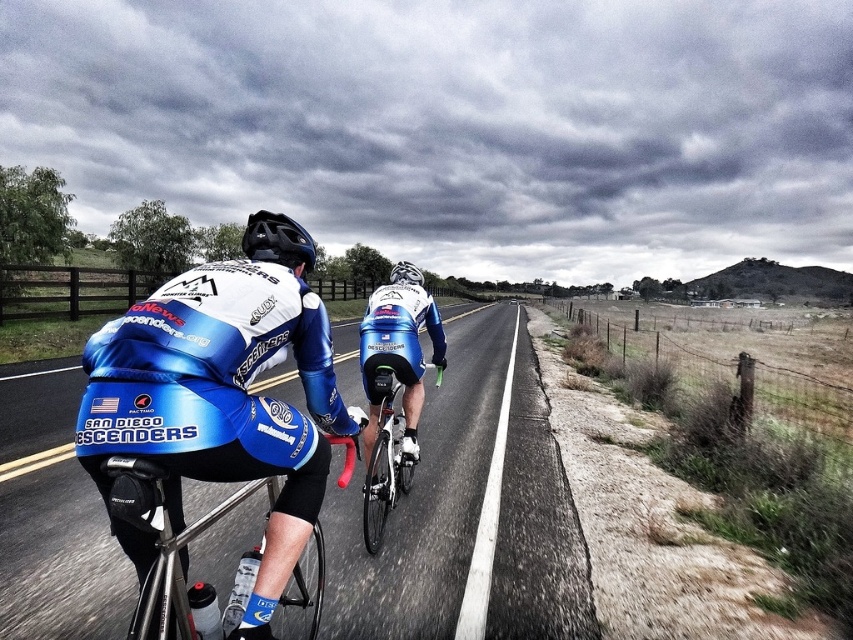
You are a cyclist on the road and see the shiny black road at center and the matte black helmet at center. Which object is positioned to the left when facing forward?

The shiny black road at center is to the left of the matte black helmet at center.

You are a photographer positioned at the side of the road. You want to capture both the shiny black frame at center and the shiny metallic bicycle at center in your shot. Which object should you focus on first if you want to ensure both are in clear focus?

The shiny black frame at center is above the shiny metallic bicycle at center, so you should focus on the shiny metallic bicycle at center first as it is closer to the camera. This will ensure the foreground object is sharp, and the background object will also be in focus due to the depth of field.

You are a photographer positioned at the side of the road. You want to capture a photo where both the shiny metallic bicycle at center and the matte black helmet at center are clearly visible. Considering their heights, which object should you position closer to the foreground to ensure both are in focus?

Since the shiny metallic bicycle at center is taller than the matte black helmet at center, positioning the matte black helmet at center closer to the foreground will help ensure both are in focus as the taller bicycle can be seen over the helmet.